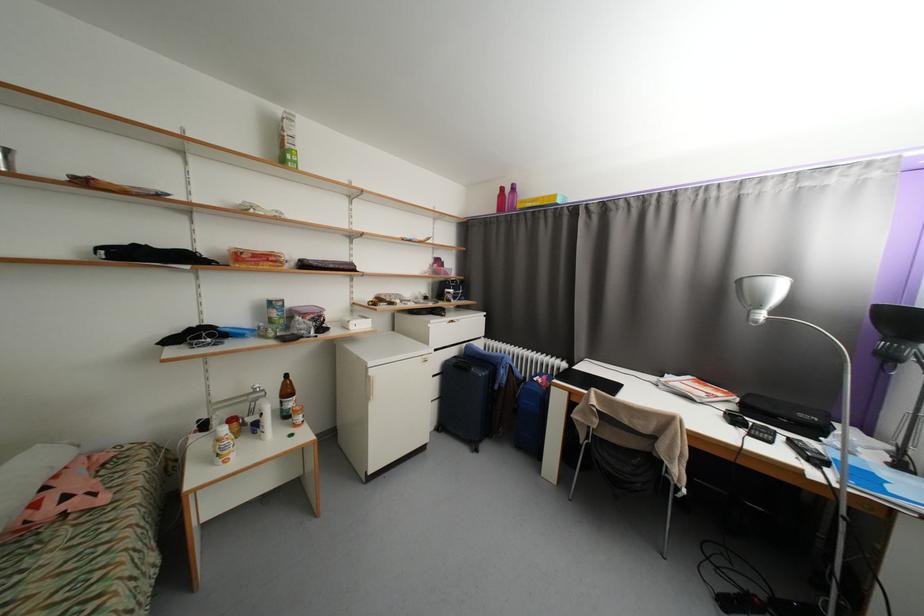
Identify the location of suitcase handle. click(x=468, y=368).